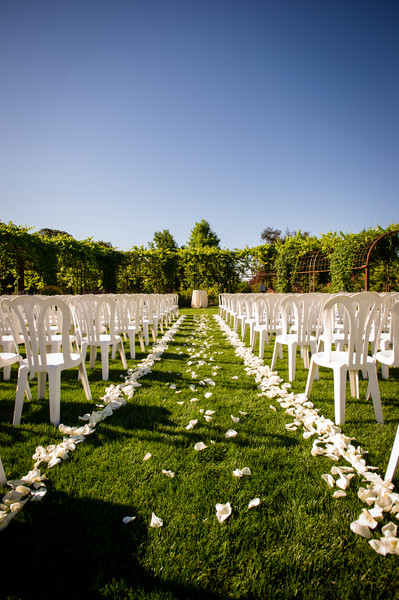
Locate an element on the screen. table is located at coordinates (199, 295).